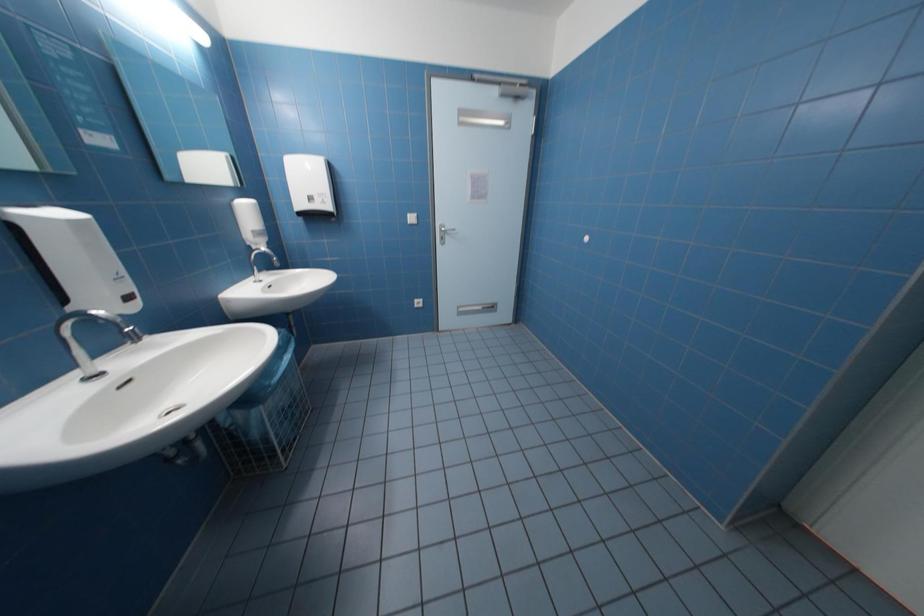
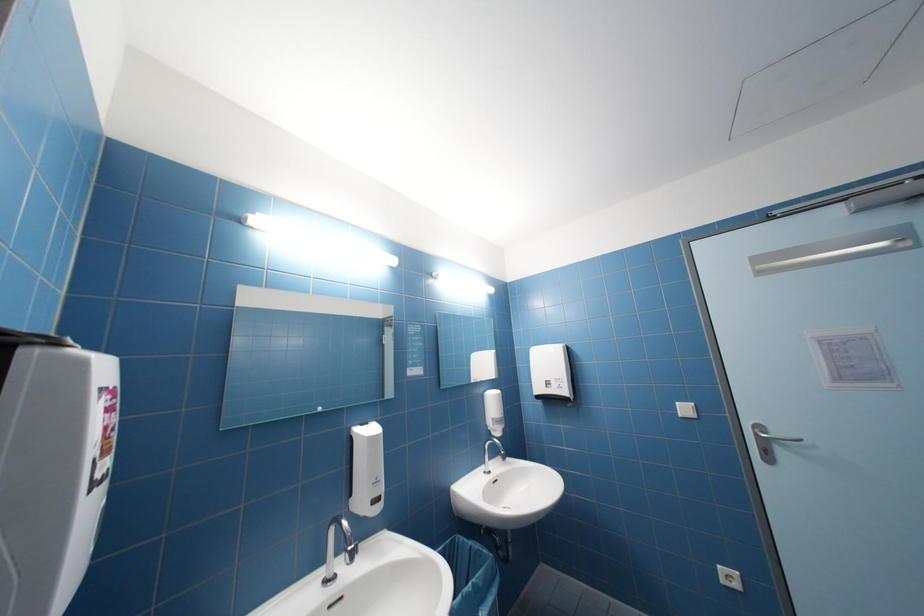
Based on the continuous images, in which direction is the camera rotating?

The camera's rotation is toward left-up.